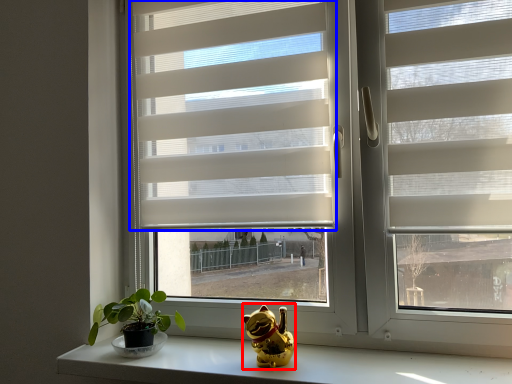
Question: Which object is closer to the camera taking this photo, figurine (highlighted by a red box) or window blind (highlighted by a blue box)?

Choices:
 (A) figurine
 (B) window blind

Answer: (A)